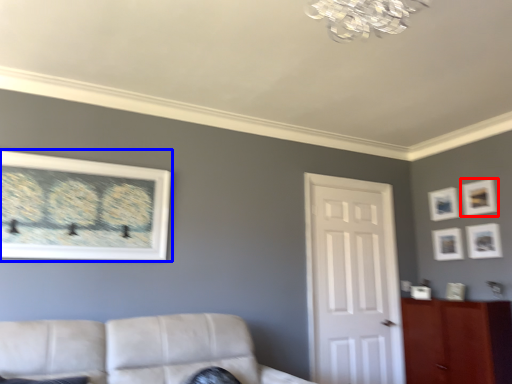
Question: Among these objects, which one is farthest to the camera, picture frame (highlighted by a red box) or picture frame (highlighted by a blue box)?

Choices:
 (A) picture frame
 (B) picture frame

Answer: (A)